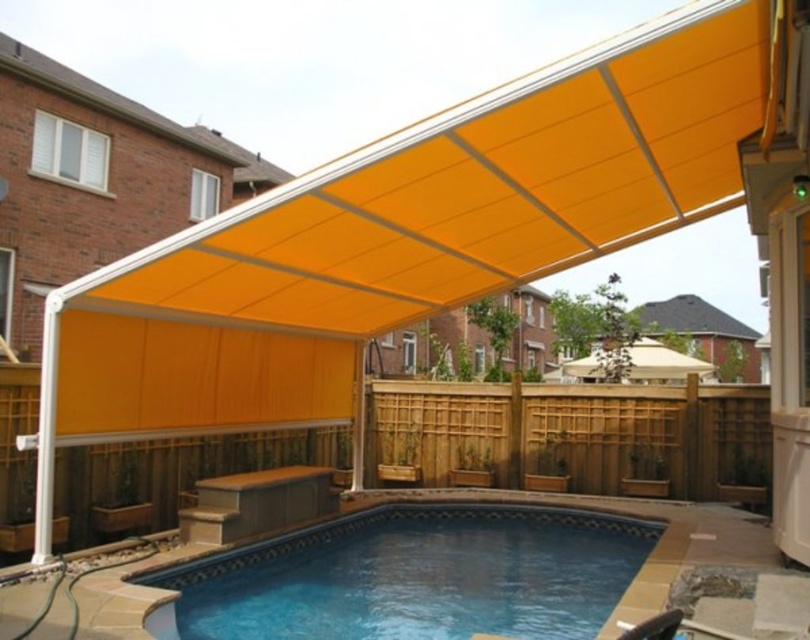
Question: Does blue tile swimming pool at center appear on the right side of orange fabric awning at center?

Choices:
 (A) yes
 (B) no

Answer: (A)

Question: Among these objects, which one is farthest from the camera?

Choices:
 (A) blue tile swimming pool at center
 (B) orange fabric awning at center

Answer: (A)

Question: Which object appears closest to the camera in this image?

Choices:
 (A) orange fabric awning at center
 (B) blue tile swimming pool at center

Answer: (A)

Question: Is blue tile swimming pool at center smaller than orange fabric awning at center?

Choices:
 (A) no
 (B) yes

Answer: (B)

Question: Which object is closer to the camera taking this photo?

Choices:
 (A) orange fabric awning at center
 (B) blue tile swimming pool at center

Answer: (A)

Question: Observing the image, what is the correct spatial positioning of blue tile swimming pool at center in reference to orange fabric awning at center?

Choices:
 (A) left
 (B) right

Answer: (B)